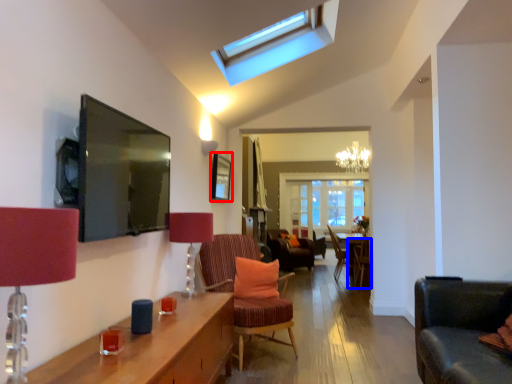
Question: Which of the following is the closest to the observer, picture frame (highlighted by a red box) or chair (highlighted by a blue box)?

Choices:
 (A) picture frame
 (B) chair

Answer: (A)